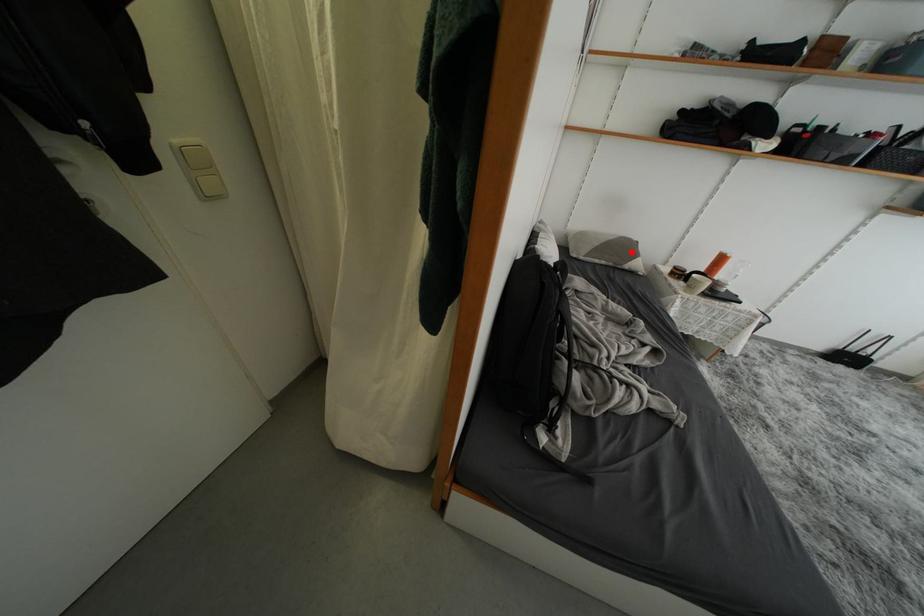
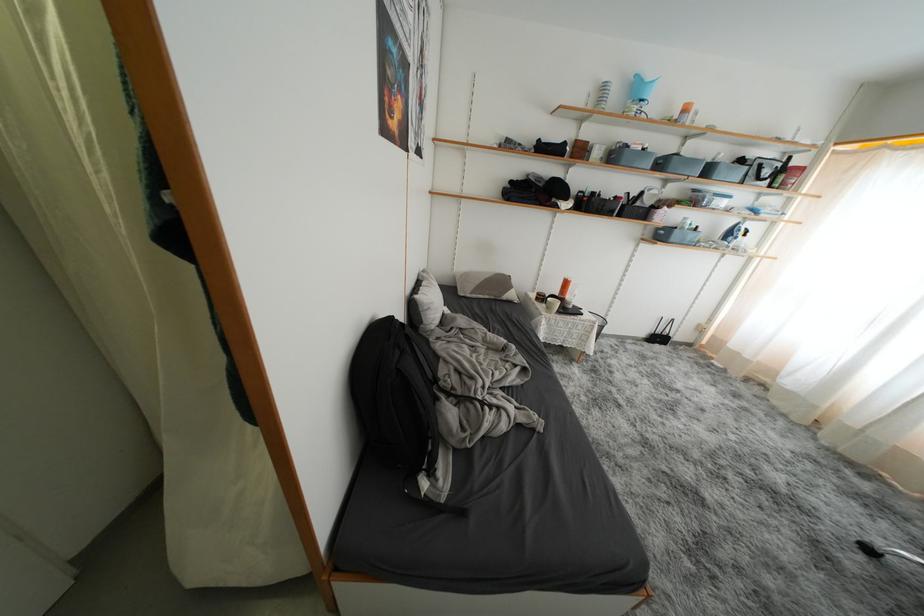
Locate, in the second image, the point that corresponds to the highlighted location in the first image.

(508, 286)